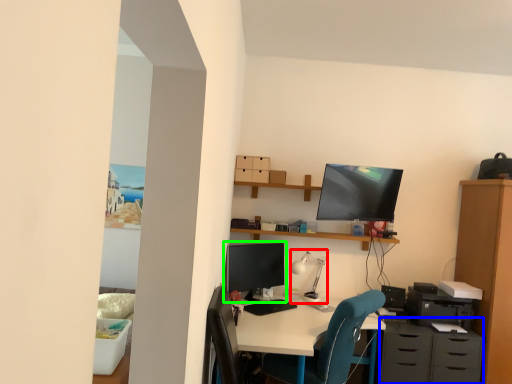
Question: Based on their relative distances, which object is farther from lamp (highlighted by a red box)? Choose from dresser (highlighted by a blue box) and computer monitor (highlighted by a green box).

Choices:
 (A) dresser
 (B) computer monitor

Answer: (A)